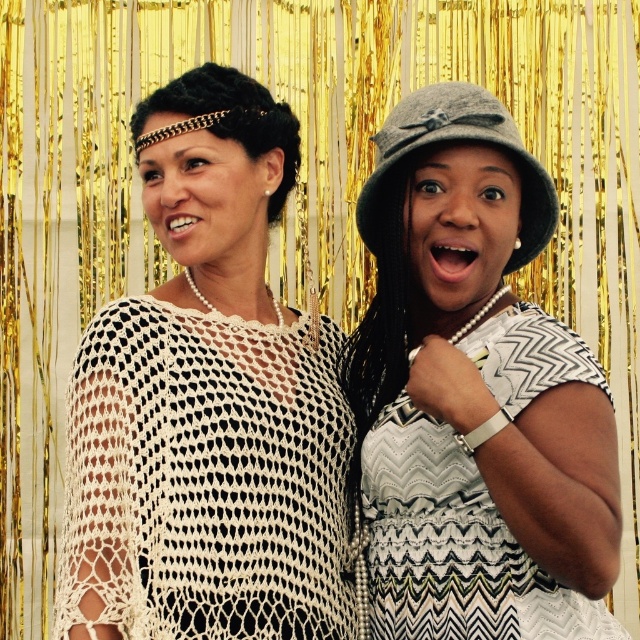
Does gray felt hat at center appear under gray felt hat at upper center?

Indeed, gray felt hat at center is positioned under gray felt hat at upper center.

Between point (477, 468) and point (449, 122), which one is positioned behind?

The point (449, 122) is more distant.

What are the coordinates of `gray felt hat at center` in the screenshot? It's located at (474, 394).

Is white crochet top at center taller than gray felt hat at upper center?

Yes, white crochet top at center is taller than gray felt hat at upper center.

The width and height of the screenshot is (640, 640). Find the location of `white crochet top at center`. white crochet top at center is located at coordinates [208, 403].

Which is behind, point (259, 145) or point (454, 620)?

The point (259, 145) is behind.

Is white crochet top at center closer to the viewer compared to gray felt hat at center?

That is False.

Measure the distance between point (240,132) and camera.

Point (240,132) and camera are 15.07 meters apart from each other.

Locate an element on the screen. white crochet top at center is located at coordinates (208, 403).